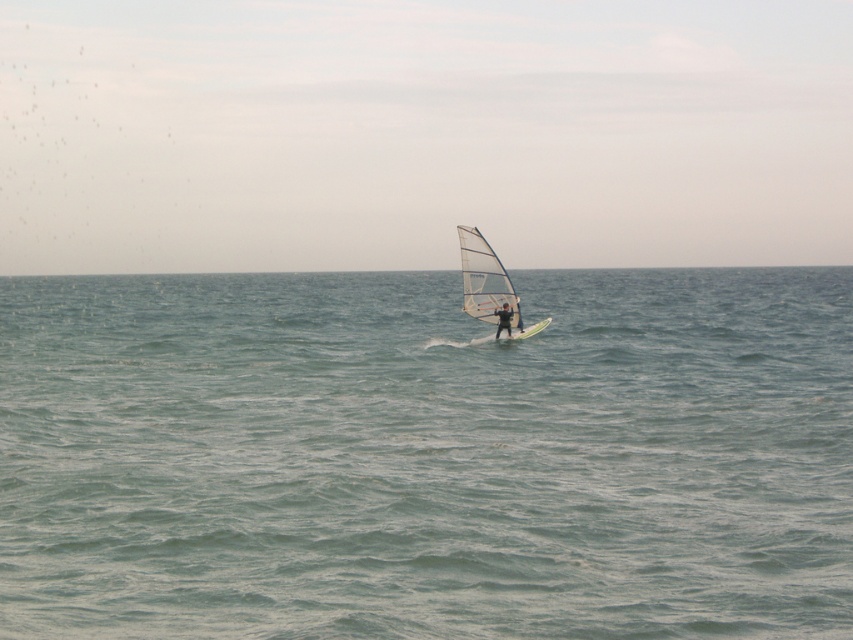
Is point (753, 476) farther from camera compared to point (474, 289)?

No.

Does clear blue water at center appear over white matte sail at center?

Yes, clear blue water at center is above white matte sail at center.

Measure the distance between point (656, 396) and camera.

Point (656, 396) and camera are 27.74 meters apart.

The height and width of the screenshot is (640, 853). In order to click on clear blue water at center in this screenshot , I will do `click(426, 456)`.

Does white matte sail at center appear on the left side of matte black windsurfer at center?

Indeed, white matte sail at center is positioned on the left side of matte black windsurfer at center.

From the picture: Is white matte sail at center further to the viewer compared to matte black windsurfer at center?

No, white matte sail at center is in front of matte black windsurfer at center.

Does point (498, 289) come closer to viewer compared to point (508, 314)?

No, it is not.

Identify the location of white matte sail at center. Image resolution: width=853 pixels, height=640 pixels. (489, 284).

Based on the photo, does transparent sail at center appear under green matte surfboard at center?

No, transparent sail at center is not below green matte surfboard at center.

Who is taller, transparent sail at center or green matte surfboard at center?

Standing taller between the two is transparent sail at center.

You are a GUI agent. You are given a task and a screenshot of the screen. Output one action in this format:
    pyautogui.click(x=<x>, y=<y>)
    Task: Click on the transparent sail at center
    
    Given the screenshot: What is the action you would take?
    pos(421,132)

The width and height of the screenshot is (853, 640). In order to click on transparent sail at center in this screenshot , I will do `click(421, 132)`.